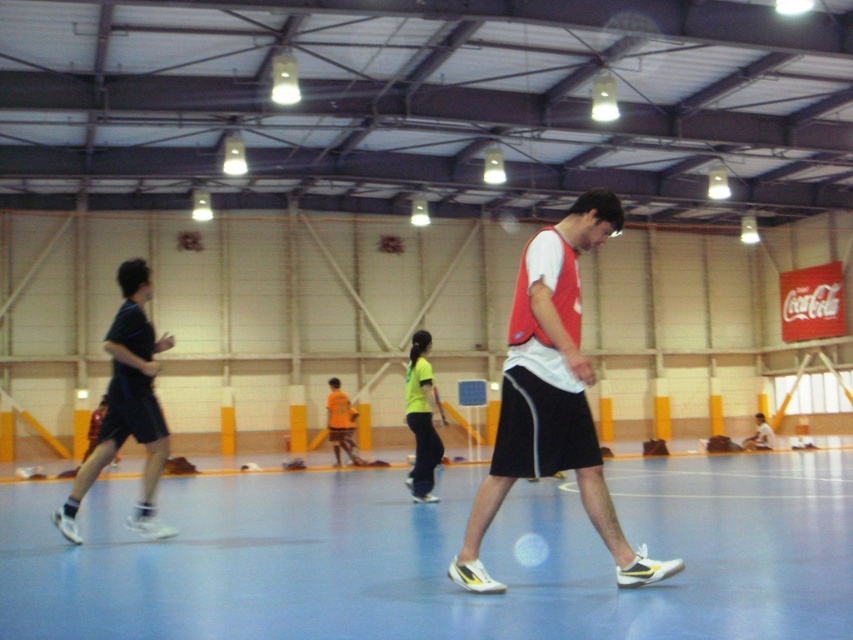
Question: In this image, where is dark blue fabric shorts at left located relative to light blue fabric shirt at center?

Choices:
 (A) left
 (B) right

Answer: (A)

Question: Which is farther from the orange jersey at center?

Choices:
 (A) matte red vest at center
 (B) neon yellow jersey at center
 (C) light blue fabric shirt at center

Answer: (A)

Question: Among these objects, which one is nearest to the camera?

Choices:
 (A) light blue fabric shirt at center
 (B) dark blue fabric shorts at left

Answer: (B)

Question: Observing the image, what is the correct spatial positioning of blue rubber basketball court at center in reference to dark blue fabric shorts at left?

Choices:
 (A) below
 (B) above

Answer: (A)

Question: Does neon yellow jersey at center appear over orange jersey at center?

Choices:
 (A) no
 (B) yes

Answer: (B)

Question: Which point is closer to the camera?

Choices:
 (A) matte red vest at center
 (B) orange jersey at center

Answer: (A)